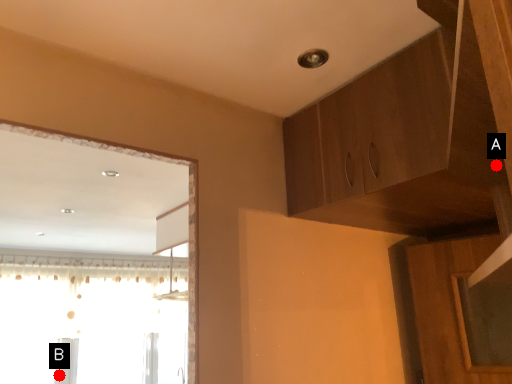
Question: Two points are circled on the image, labeled by A and B beside each circle. Which of the following is the farthest from the observer?

Choices:
 (A) A is further
 (B) B is further

Answer: (B)